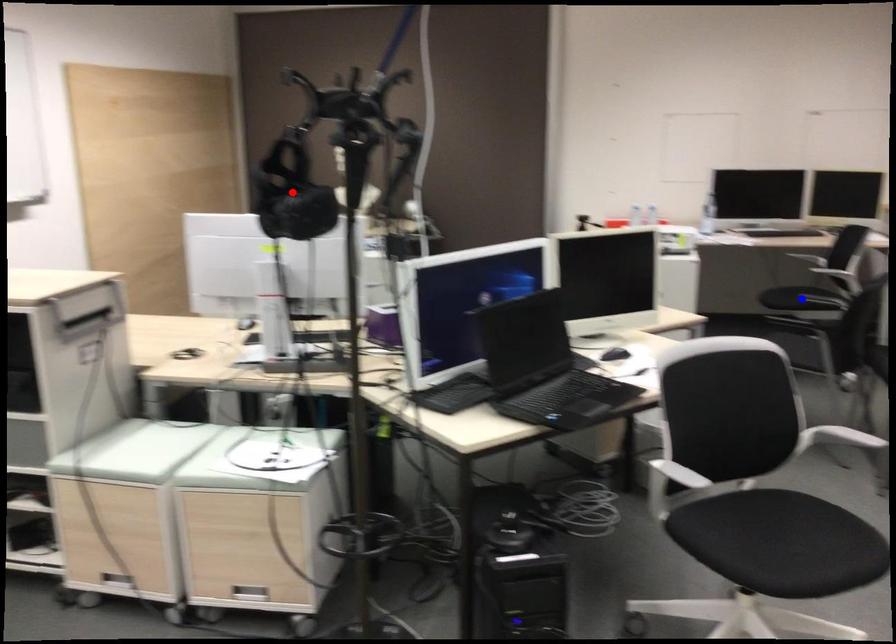
Question: In the image, two points are highlighted. Which point is nearer to the camera? Reply with the corresponding letter.

Choices:
 (A) blue point
 (B) red point

Answer: (B)